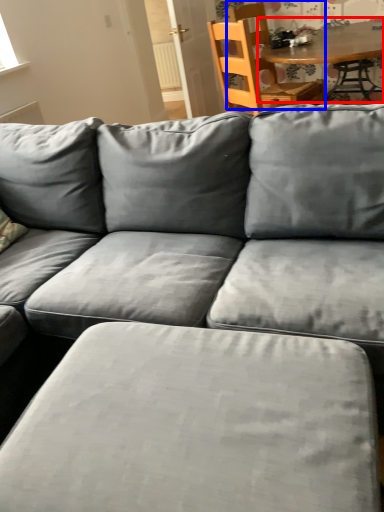
Question: Which object is further to the camera taking this photo, table (highlighted by a red box) or chair (highlighted by a blue box)?

Choices:
 (A) table
 (B) chair

Answer: (B)